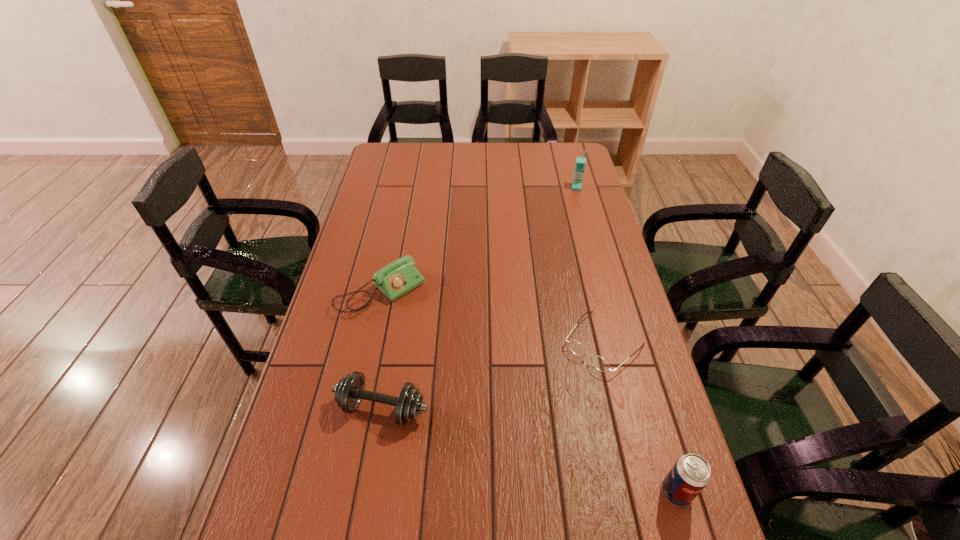
You are a GUI agent. You are given a task and a screenshot of the screen. Output one action in this format:
    pyautogui.click(x=<x>, y=<y>)
    Task: Click on the dumbbell that is at the left edge
    The image size is (960, 540).
    Given the screenshot: What is the action you would take?
    pyautogui.click(x=349, y=391)

I want to click on telephone present at the left edge, so click(399, 277).

Locate an element on the screen. The height and width of the screenshot is (540, 960). beer can at the right edge is located at coordinates (691, 473).

You are a GUI agent. You are given a task and a screenshot of the screen. Output one action in this format:
    pyautogui.click(x=<x>, y=<y>)
    Task: Click on the spectacles that is at the right edge
    This screenshot has width=960, height=540.
    Given the screenshot: What is the action you would take?
    pyautogui.click(x=599, y=363)

Locate an element on the screen. The image size is (960, 540). cellular telephone located in the right edge section of the desktop is located at coordinates point(580,161).

The height and width of the screenshot is (540, 960). I want to click on object present at the near right corner, so pyautogui.click(x=691, y=473).

Where is `vacant space at the far edge of the desktop`? vacant space at the far edge of the desktop is located at coordinates (468, 148).

This screenshot has width=960, height=540. Identify the location of vacant space at the near edge. (540, 526).

At what (x,y) coordinates should I click in order to perform the action: click on free space at the left edge. Please return your answer as a coordinate pair (x, y). The height and width of the screenshot is (540, 960). Looking at the image, I should click on (333, 464).

Locate an element on the screen. free point at the right edge is located at coordinates (570, 188).